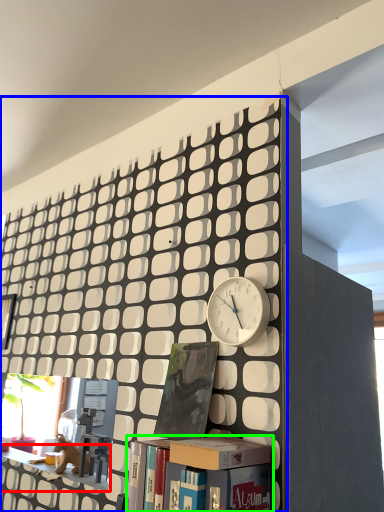
Question: Considering the real-world distances, which object is closest to shelf (highlighted by a red box)? bookcase (highlighted by a blue box) or book (highlighted by a green box).

Choices:
 (A) bookcase
 (B) book

Answer: (A)